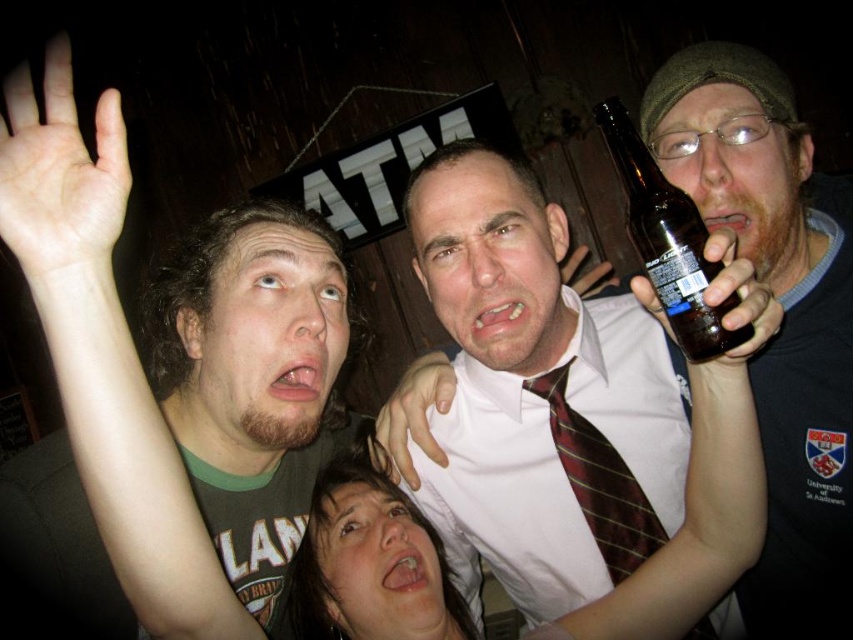
Which is more to the right, maroon striped tie at center or matte black bottle at upper right?

From the viewer's perspective, matte black bottle at upper right appears more on the right side.

Does maroon striped tie at center appear over matte black bottle at upper right?

Incorrect, maroon striped tie at center is not positioned above matte black bottle at upper right.

You are a GUI agent. You are given a task and a screenshot of the screen. Output one action in this format:
    pyautogui.click(x=<x>, y=<y>)
    Task: Click on the maroon striped tie at center
    This screenshot has height=640, width=853.
    Given the screenshot: What is the action you would take?
    pyautogui.click(x=599, y=483)

Between smooth skin hand at center and matte black bottle at upper right, which one is positioned lower?

smooth skin hand at center is lower down.

Can you confirm if smooth skin hand at center is thinner than matte black bottle at upper right?

Correct, smooth skin hand at center's width is less than matte black bottle at upper right's.

What are the coordinates of `smooth skin hand at center` in the screenshot? It's located at (415, 416).

Find the location of a particular element. This screenshot has width=853, height=640. smooth skin hand at center is located at coordinates (415, 416).

Is matte black shirt at center bigger than maroon striped tie at center?

Indeed, matte black shirt at center has a larger size compared to maroon striped tie at center.

Is matte black shirt at center smaller than maroon striped tie at center?

Actually, matte black shirt at center might be larger than maroon striped tie at center.

Who is more forward, (850,272) or (602,436)?

Positioned in front is point (850,272).

Identify the location of matte black shirt at center. (782, 316).